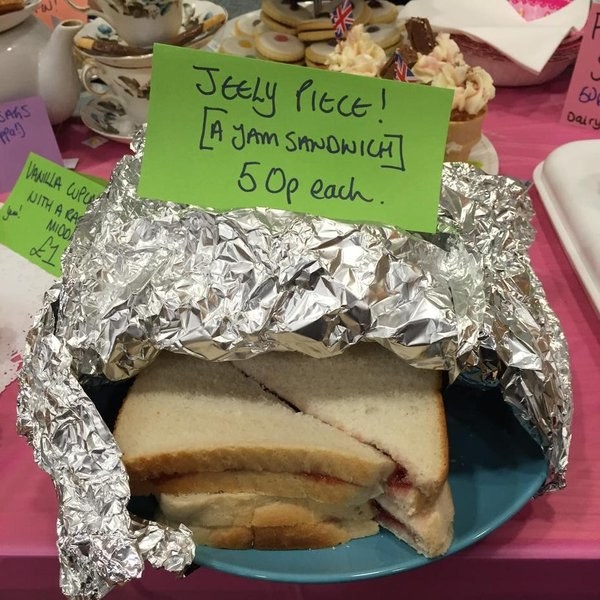
You are a GUI agent. You are given a task and a screenshot of the screen. Output one action in this format:
    pyautogui.click(x=<x>, y=<y>)
    Task: Click on the table cloth
    The height and width of the screenshot is (600, 600).
    Given the screenshot: What is the action you would take?
    click(22, 488), click(557, 532), click(527, 148)